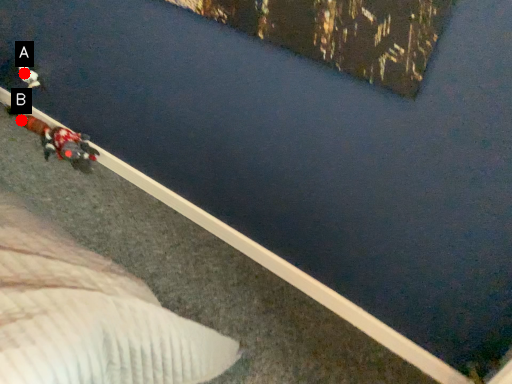
Question: Two points are circled on the image, labeled by A and B beside each circle. Which point appears closest to the camera in this image?

Choices:
 (A) A is closer
 (B) B is closer

Answer: (A)